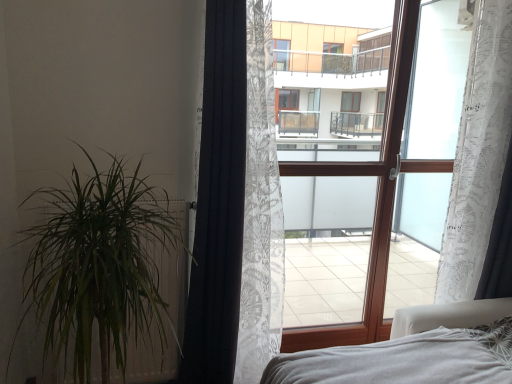
Question: Is white sheer curtain at right oriented away from transparent fabric at center?

Choices:
 (A) no
 (B) yes

Answer: (A)

Question: Is white sheer curtain at right at the left side of transparent fabric at center?

Choices:
 (A) yes
 (B) no

Answer: (B)

Question: Does white sheer curtain at right have a greater width compared to transparent fabric at center?

Choices:
 (A) yes
 (B) no

Answer: (B)

Question: Could you tell me if white sheer curtain at right is turned towards transparent fabric at center?

Choices:
 (A) no
 (B) yes

Answer: (A)

Question: From a real-world perspective, is white sheer curtain at right beneath transparent fabric at center?

Choices:
 (A) no
 (B) yes

Answer: (A)

Question: Relative to black textured curtain at left, marked as the 1th curtain in a left-to-right arrangement, is white sheer curtain at right in front or behind?

Choices:
 (A) behind
 (B) front

Answer: (A)

Question: Based on their positions, is white sheer curtain at right located to the left or right of black textured curtain at left, marked as the 1th curtain in a left-to-right arrangement?

Choices:
 (A) left
 (B) right

Answer: (B)

Question: From a real-world perspective, is white sheer curtain at right positioned above or below black textured curtain at left, marked as the 1th curtain in a left-to-right arrangement?

Choices:
 (A) above
 (B) below

Answer: (A)

Question: Is white sheer curtain at right bigger or smaller than black textured curtain at left, acting as the 3th curtain starting from the right?

Choices:
 (A) big
 (B) small

Answer: (B)

Question: Is black textured curtain at left, acting as the 3th curtain starting from the right, to the left or to the right of green leafy plant at left in the image?

Choices:
 (A) left
 (B) right

Answer: (B)

Question: Considering the positions of black textured curtain at left, marked as the 1th curtain in a left-to-right arrangement, and green leafy plant at left in the image, is black textured curtain at left, marked as the 1th curtain in a left-to-right arrangement, taller or shorter than green leafy plant at left?

Choices:
 (A) tall
 (B) short

Answer: (A)

Question: From the image's perspective, is black textured curtain at left, marked as the 1th curtain in a left-to-right arrangement, located above or below green leafy plant at left?

Choices:
 (A) below
 (B) above

Answer: (B)

Question: Considering the positions of point (234, 198) and point (79, 269), is point (234, 198) closer or farther from the camera than point (79, 269)?

Choices:
 (A) farther
 (B) closer

Answer: (A)

Question: Visually, is white sheer curtain at right positioned to the left or to the right of white lace curtain at right, which is counted as the 3th curtain, starting from the left?

Choices:
 (A) right
 (B) left

Answer: (B)

Question: From the image's perspective, relative to white lace curtain at right, the 1th curtain positioned from the right, is white sheer curtain at right above or below?

Choices:
 (A) above
 (B) below

Answer: (A)